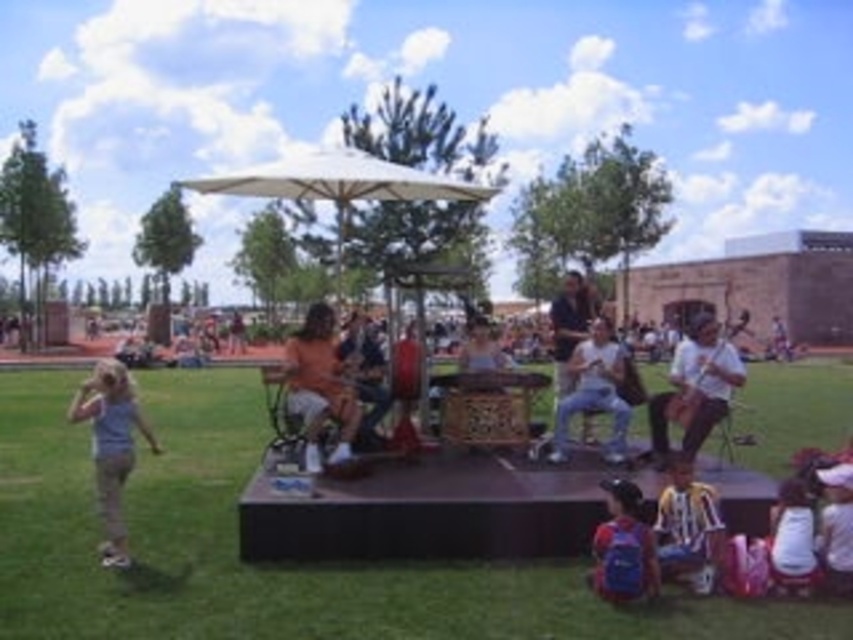
Question: Which object is positioned closest to the green grass at center?

Choices:
 (A) blue backpack at lower center
 (B) white fabric guitar at center
 (C) white fabric drum at right
 (D) white cotton shirt at lower right

Answer: (A)

Question: Which of the following is the closest to the observer?

Choices:
 (A) white fabric drum at right
 (B) blue backpack at lower center
 (C) orange fabric at center

Answer: (B)

Question: Which point is farther to the camera?

Choices:
 (A) (112, 419)
 (B) (138, 531)
 (C) (602, 326)

Answer: (C)

Question: Observing the image, what is the correct spatial positioning of white fabric guitar at center in reference to white cotton shirt at lower right?

Choices:
 (A) right
 (B) left

Answer: (B)

Question: Can you confirm if light blue fabric at lower left is thinner than blue backpack at lower center?

Choices:
 (A) yes
 (B) no

Answer: (B)

Question: Observing the image, what is the correct spatial positioning of green grass at center in reference to blue backpack at lower center?

Choices:
 (A) right
 (B) left

Answer: (B)